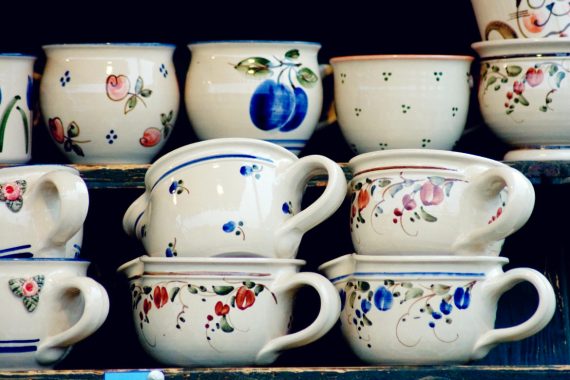
The width and height of the screenshot is (570, 380). In order to click on red stripes on mugs in this screenshot , I will do `click(198, 272)`, `click(401, 165)`, `click(390, 55)`, `click(556, 142)`.